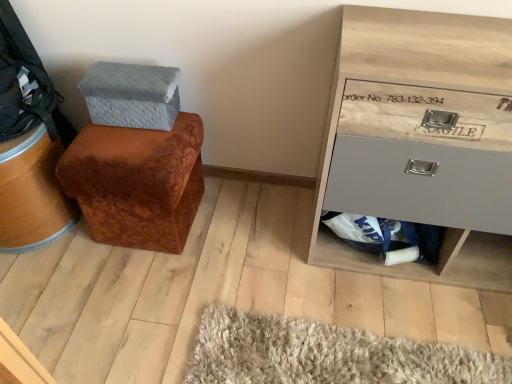
Identify the location of free space to the left of wooden drawer at right. The width and height of the screenshot is (512, 384). (266, 263).